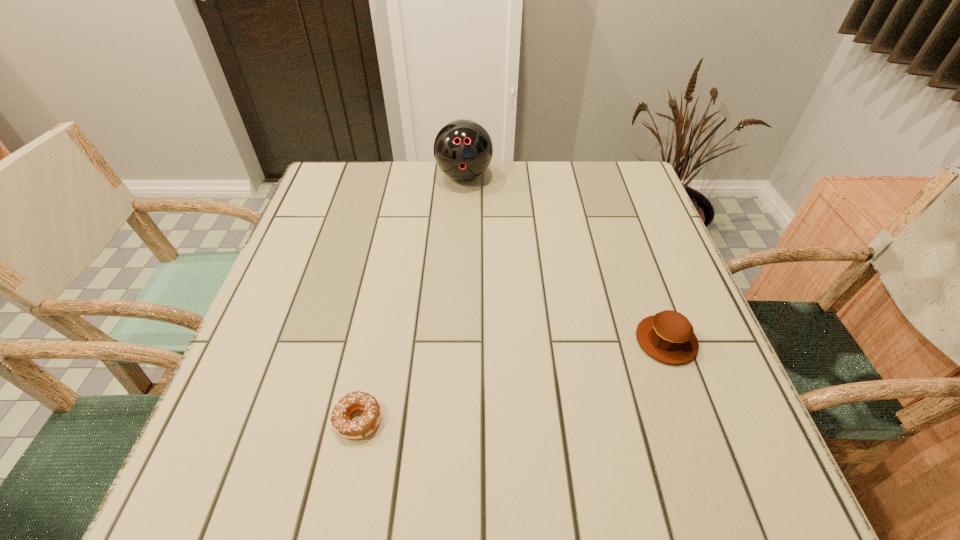
Find the location of a particular element. vacant region that satisfies the following two spatial constraints: 1. on the surface of the second farthest object near the finger holes; 2. on the right side of the bowling ball is located at coordinates (457, 341).

You are a GUI agent. You are given a task and a screenshot of the screen. Output one action in this format:
    pyautogui.click(x=<x>, y=<y>)
    Task: Click on the vacant area in the image that satisfies the following two spatial constraints: 1. on the back side of the second nearest object; 2. on the right side of the doughnut
    The height and width of the screenshot is (540, 960).
    Given the screenshot: What is the action you would take?
    pyautogui.click(x=374, y=341)